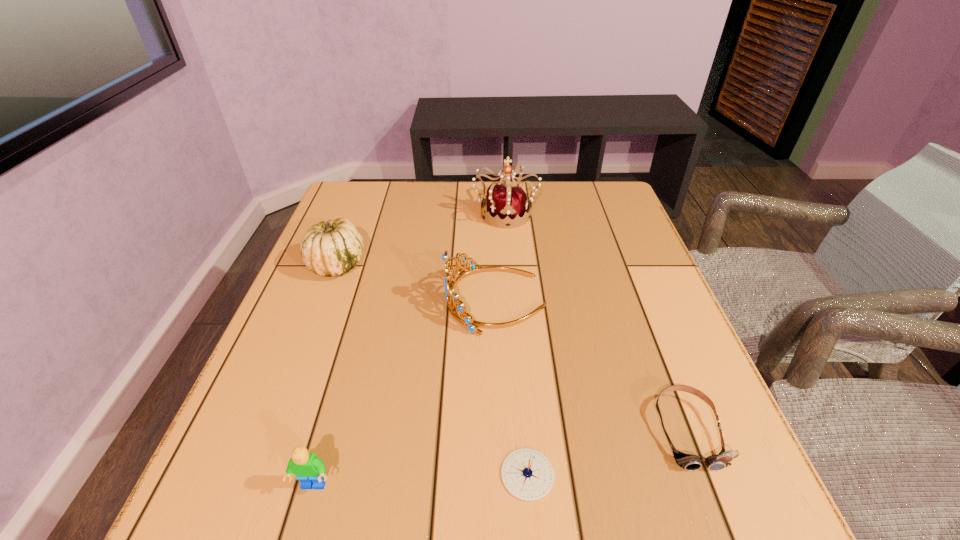
Locate an element on the screen. The width and height of the screenshot is (960, 540). the taller tiara is located at coordinates (503, 201).

I want to click on the farther tiara, so click(x=503, y=201).

Identify the location of the nearer tiara. (456, 307).

What are the coordinates of `gourd` in the screenshot? It's located at (330, 248).

Locate an element on the screen. Image resolution: width=960 pixels, height=540 pixels. the fourth tallest object is located at coordinates (310, 470).

Locate an element on the screen. This screenshot has width=960, height=540. the rightmost object is located at coordinates (689, 462).

Locate an element on the screen. compass is located at coordinates (527, 474).

In order to click on vacant area situated 0.140m on the front-facing side of the farthest object in this screenshot , I will do `click(509, 263)`.

Find the location of a particular element. Image resolution: width=960 pixels, height=540 pixels. free space located on the front-facing side of the nearer tiara is located at coordinates (301, 300).

Where is `vacant space located 0.110m on the front-facing side of the nearer tiara`? The width and height of the screenshot is (960, 540). vacant space located 0.110m on the front-facing side of the nearer tiara is located at coordinates (396, 300).